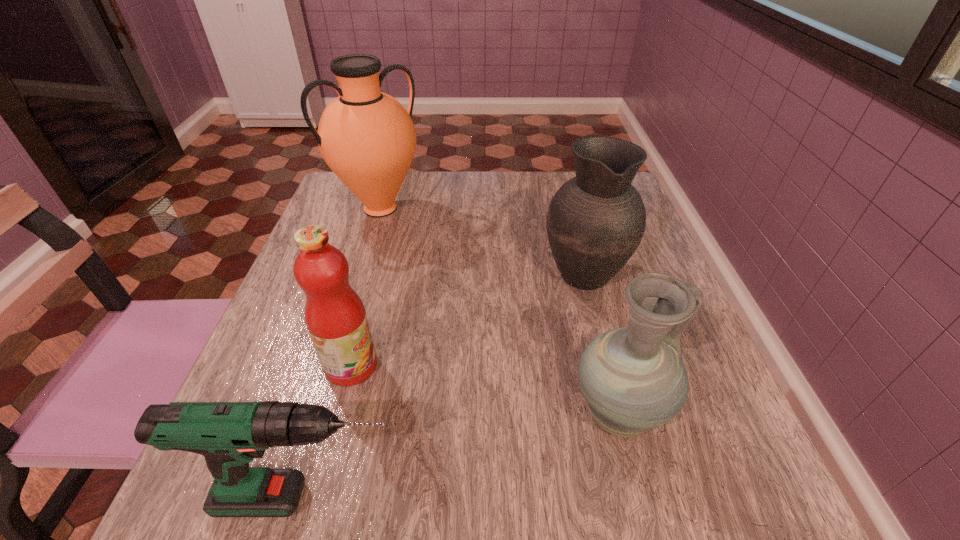
You are a GUI agent. You are given a task and a screenshot of the screen. Output one action in this format:
    pyautogui.click(x=<x>, y=<y>)
    Task: Click on the unoccupied position between the second farthest pitcher and the farthest object
    
    Given the screenshot: What is the action you would take?
    pyautogui.click(x=482, y=240)

Find the location of `free space that is in between the second farthest pitcher and the tallest object`. free space that is in between the second farthest pitcher and the tallest object is located at coordinates (482, 240).

I want to click on vacant point located between the nearest pitcher and the tallest object, so click(499, 312).

Identify the location of object that is the third closest to the fourth nearest object. (335, 316).

Identify which object is the second closest to the fruit juice. Please provide its 2D coordinates. Your answer should be formatted as a tuple, i.e. [(x, y)], where the tuple contains the x and y coordinates of a point satisfying the conditions above.

[(633, 378)]

Select which pitcher is the second closest to the second nearest pitcher. Please provide its 2D coordinates. Your answer should be formatted as a tuple, i.e. [(x, y)], where the tuple contains the x and y coordinates of a point satisfying the conditions above.

[(367, 138)]

Identify the location of pitcher that is the second closest one to the second farthest object. The width and height of the screenshot is (960, 540). (367, 138).